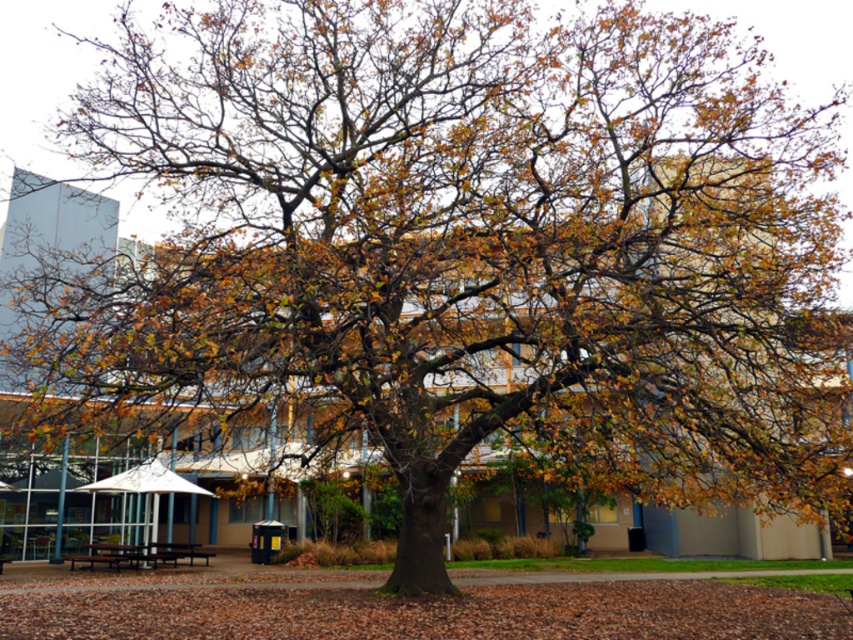
Looking at this image, you are planning to set up a picnic blanket for a family gathering. You have a picnic blanket that is 24 inches wide. There is a brown wooden picnic table at lower left and a wooden park bench at lower left. Can you place the blanket between them without overlapping either?

The distance between the brown wooden picnic table at lower left and the wooden park bench at lower left is 23.91 inches. Since the picnic blanket is 24 inches wide, it would be slightly too wide to fit between them without overlapping either object.

You are standing at the point marked as point (107, 554) in the image. Which object is exactly at that location?

The wooden park bench at lower left is exactly at point (107, 554).

You are a person who is 5 feet tall and wants to sit on the wooden park bench at lower left and the dark brown wooden bench at center. Considering your height, can you comfortably sit on both benches without any issues?

The wooden park bench at lower left and the dark brown wooden bench at center are 10.85 feet apart, so the distance between them is sufficient for you to comfortably sit on both benches without any issues related to your height.